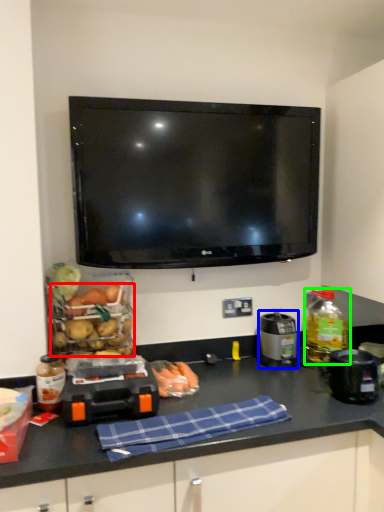
Question: Estimate the real-world distances between objects in this image. Which object is farther from food (highlighted by a red box), appliance (highlighted by a blue box) or bottle (highlighted by a green box)?

Choices:
 (A) appliance
 (B) bottle

Answer: (B)